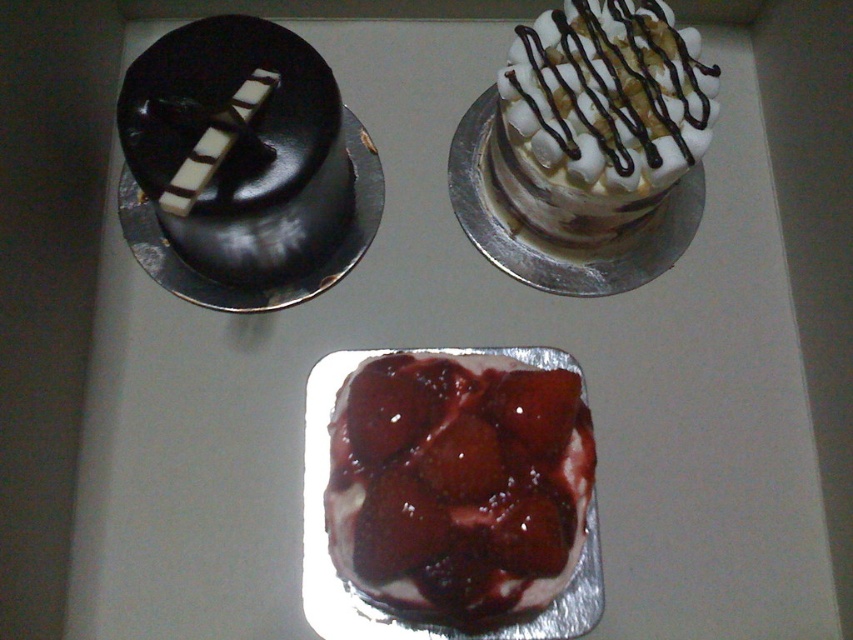
Between shiny dark chocolate cake at upper left and white marshmallow cake at upper right, which one has more height?

Standing taller between the two is shiny dark chocolate cake at upper left.

Between point (254, 115) and point (506, 96), which one is positioned in front?

Point (254, 115) is more forward.

Locate an element on the screen. This screenshot has width=853, height=640. shiny dark chocolate cake at upper left is located at coordinates (238, 148).

Is semi-glossy white cake at center in front of white marshmallow cake at upper right?

Yes, it is.

Does semi-glossy white cake at center appear under white marshmallow cake at upper right?

Indeed, semi-glossy white cake at center is positioned under white marshmallow cake at upper right.

Measure the distance between semi-glossy white cake at center and camera.

semi-glossy white cake at center and camera are 81.19 centimeters apart.

Where is `semi-glossy white cake at center`? semi-glossy white cake at center is located at coordinates (463, 492).

Does point (241, 163) come behind point (177, 211)?

Yes, point (241, 163) is behind point (177, 211).

Who is more distant from viewer, (236, 70) or (215, 115)?

Positioned behind is point (236, 70).

Locate an element on the screen. This screenshot has width=853, height=640. shiny dark chocolate cake at upper left is located at coordinates (238, 148).